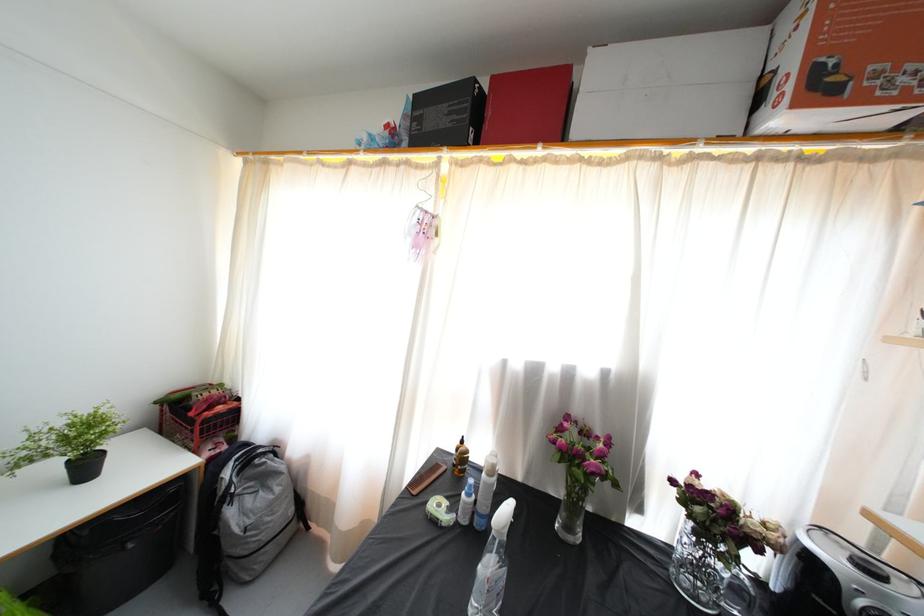
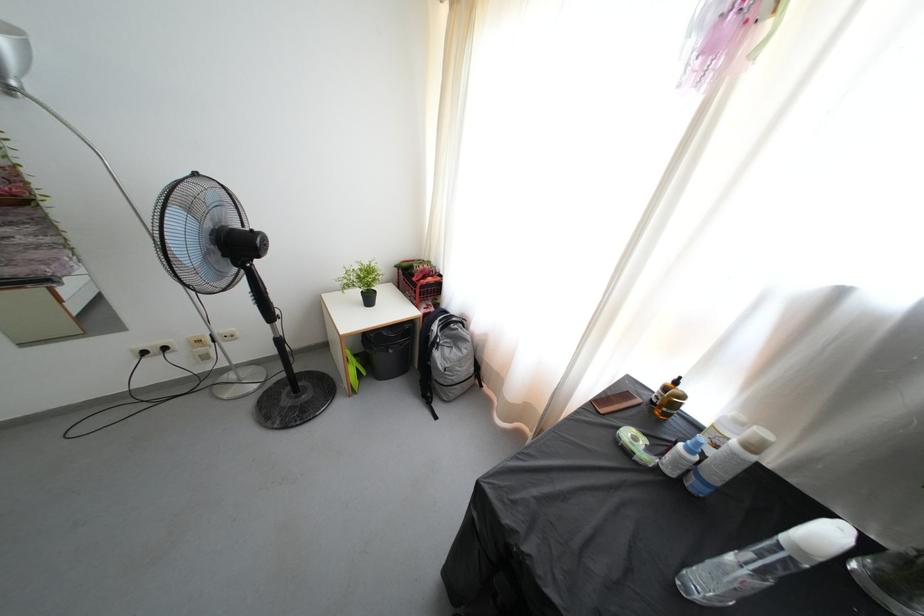
In the second image, find the point that corresponds to [91,538] in the first image.

(378, 341)